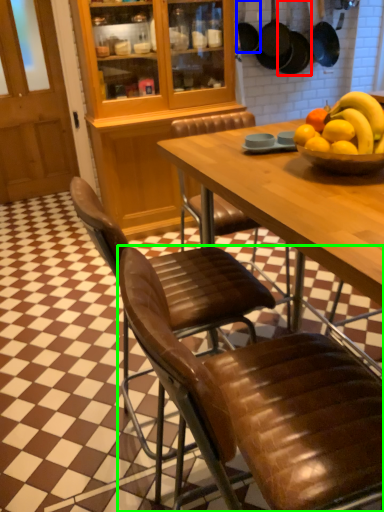
Question: Estimate the real-world distances between objects in this image. Which object is closer to frying pan (highlighted by a red box), frying pan (highlighted by a blue box) or chair (highlighted by a green box)?

Choices:
 (A) frying pan
 (B) chair

Answer: (A)